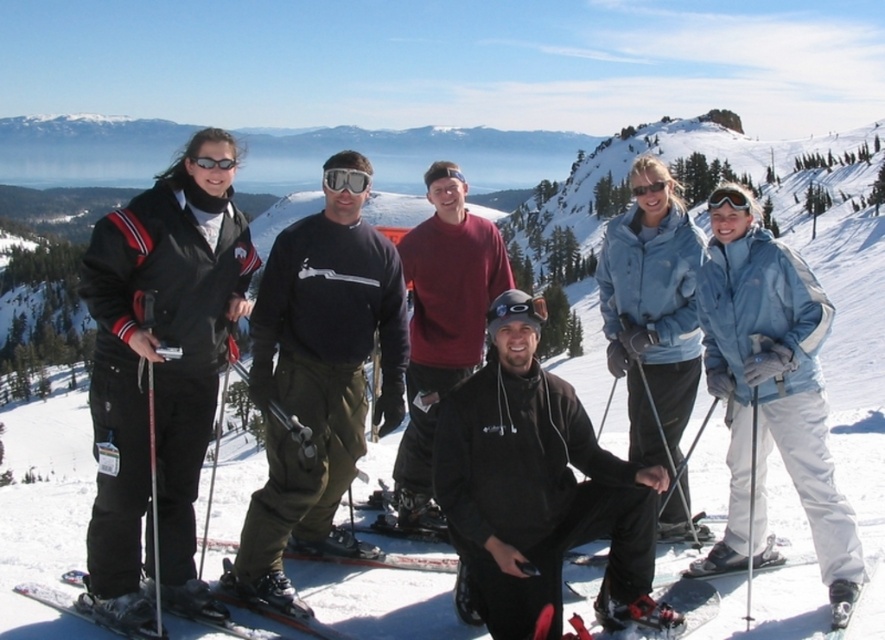
Is light blue waterproof jacket at right positioned before clear plastic goggles at center?

Yes.

Who is positioned more to the left, light blue waterproof jacket at right or clear plastic goggles at center?

Positioned to the left is clear plastic goggles at center.

The height and width of the screenshot is (640, 885). In order to click on light blue waterproof jacket at right in this screenshot , I will do `click(770, 394)`.

Is light blue waterproof jacket at right shorter than maroon sweater at center?

Yes, light blue waterproof jacket at right is shorter than maroon sweater at center.

You are a GUI agent. You are given a task and a screenshot of the screen. Output one action in this format:
    pyautogui.click(x=<x>, y=<y>)
    Task: Click on the light blue waterproof jacket at right
    
    Given the screenshot: What is the action you would take?
    pyautogui.click(x=770, y=394)

Who is positioned more to the left, black matte jacket at center or dark green pants at center?

dark green pants at center is more to the left.

Who is positioned more to the right, black matte jacket at center or dark green pants at center?

Positioned to the right is black matte jacket at center.

Where is `black matte jacket at center`? black matte jacket at center is located at coordinates click(x=537, y=486).

Identify the location of black matte jacket at center. The image size is (885, 640). (537, 486).